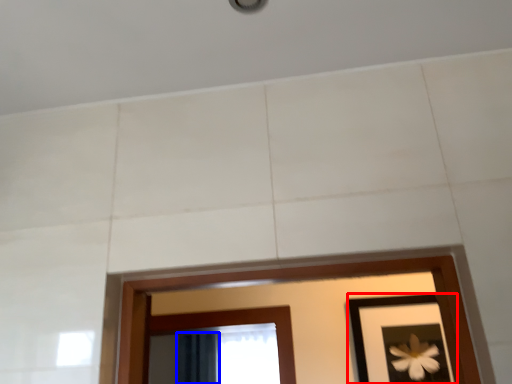
Question: Which object appears farthest to the camera in this image, picture frame (highlighted by a red box) or curtain (highlighted by a blue box)?

Choices:
 (A) picture frame
 (B) curtain

Answer: (B)